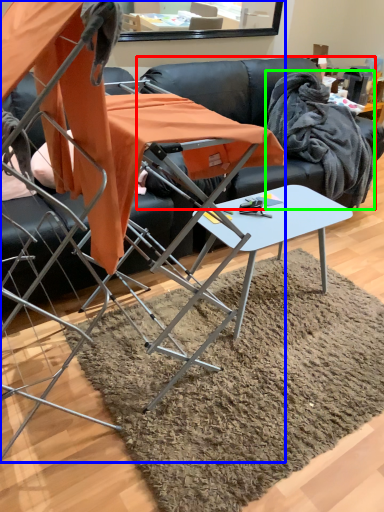
Question: Which object is the farthest from couch (highlighted by a red box)? Choose among these: chair (highlighted by a blue box) or fabric (highlighted by a green box).

Choices:
 (A) chair
 (B) fabric

Answer: (A)